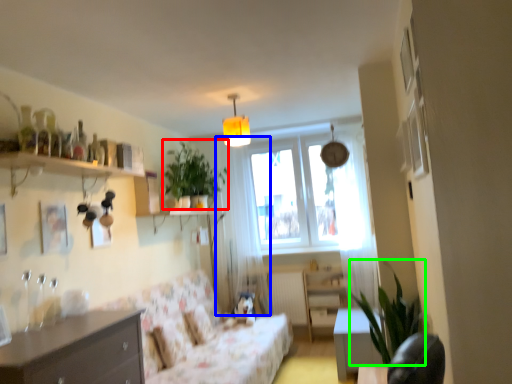
Question: Estimate the real-world distances between objects in this image. Which object is closer to plant (highlighted by a red box), curtain (highlighted by a blue box) or plant (highlighted by a green box)?

Choices:
 (A) curtain
 (B) plant

Answer: (A)